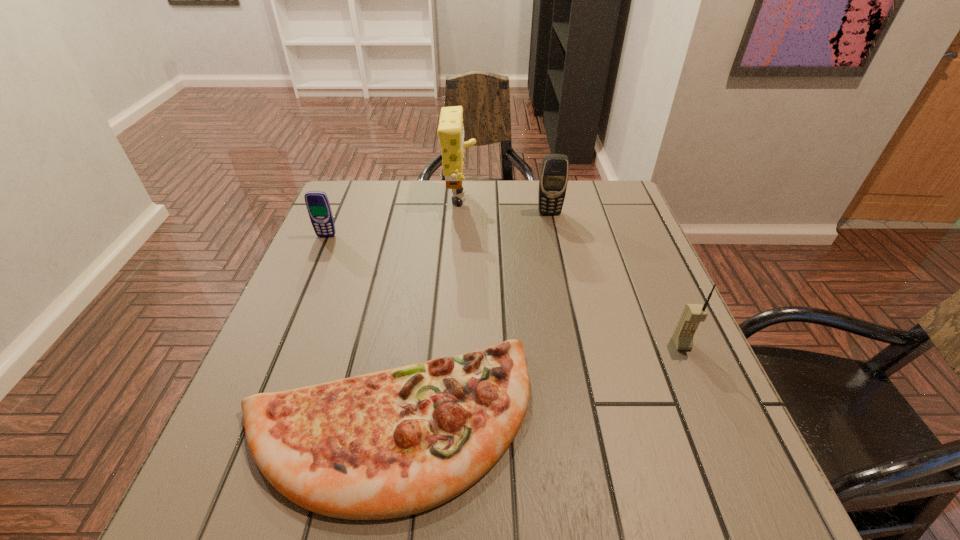
Locate an element on the screen. This screenshot has height=540, width=960. unoccupied position between the second cellular telephone from right to left and the nearest cellular telephone is located at coordinates (615, 279).

Where is `empty location between the shortest cellular telephone and the tallest object`? empty location between the shortest cellular telephone and the tallest object is located at coordinates (394, 219).

The image size is (960, 540). I want to click on free space between the nearest cellular telephone and the fourth object from left to right, so click(x=615, y=279).

The height and width of the screenshot is (540, 960). I want to click on vacant point located between the sponge and the shortest object, so click(423, 313).

The height and width of the screenshot is (540, 960). In order to click on vacant area that lies between the second cellular telephone from left to right and the leftmost cellular telephone in this screenshot , I will do `click(438, 225)`.

This screenshot has width=960, height=540. I want to click on vacant area that lies between the rightmost cellular telephone and the nearest object, so click(x=534, y=383).

Where is `vacant space that is in between the fourth farthest object and the pizza`? This screenshot has height=540, width=960. vacant space that is in between the fourth farthest object and the pizza is located at coordinates (534, 383).

Locate an element on the screen. The width and height of the screenshot is (960, 540). object that is the closest to the second shortest object is located at coordinates (450, 131).

Image resolution: width=960 pixels, height=540 pixels. Identify the location of the second closest object to the rightmost cellular telephone. (553, 179).

Identify which cellular telephone is the second nearest to the nearest object. Please provide its 2D coordinates. Your answer should be formatted as a tuple, i.e. [(x, y)], where the tuple contains the x and y coordinates of a point satisfying the conditions above.

[(317, 203)]